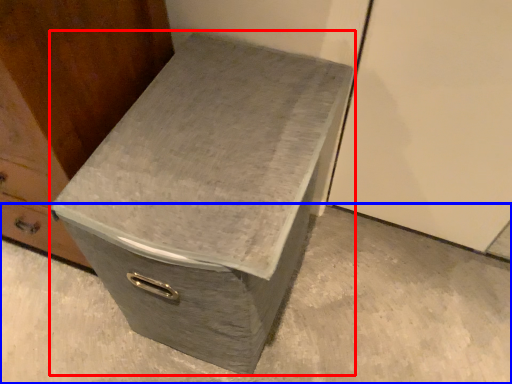
Question: Which object appears farthest to the camera in this image, shoe box (highlighted by a red box) or concrete (highlighted by a blue box)?

Choices:
 (A) shoe box
 (B) concrete

Answer: (B)